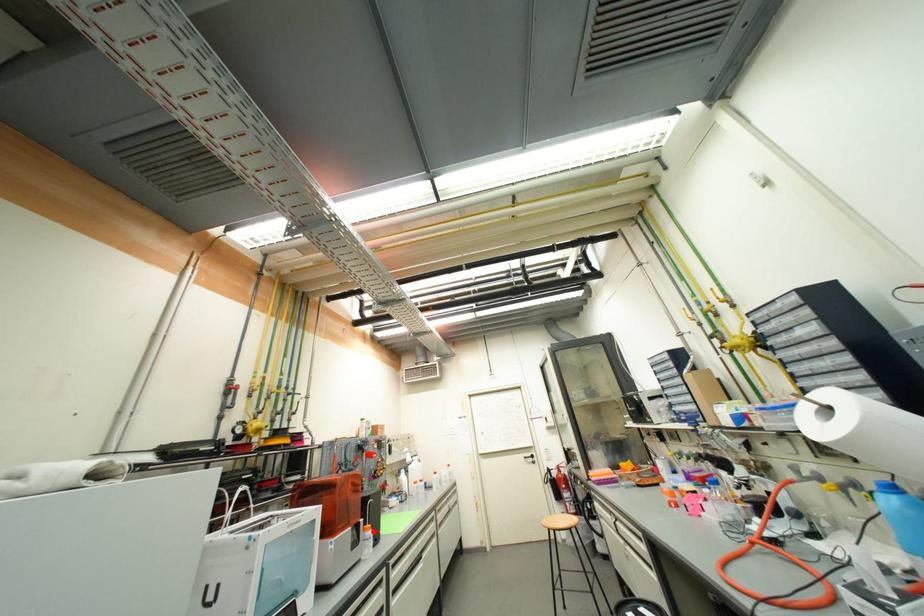
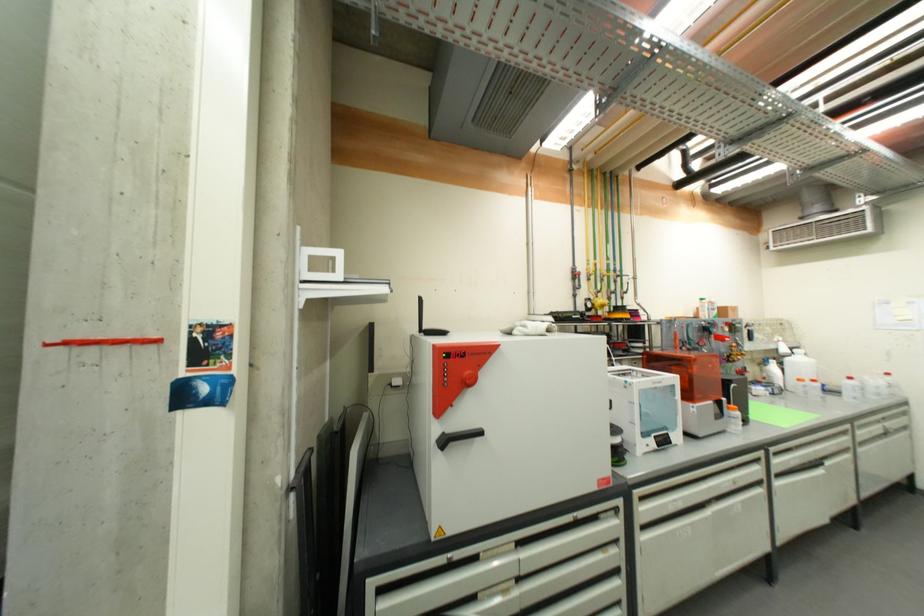
Locate, in the second image, the point that corresponds to the highlighted location in the first image.

(739, 411)